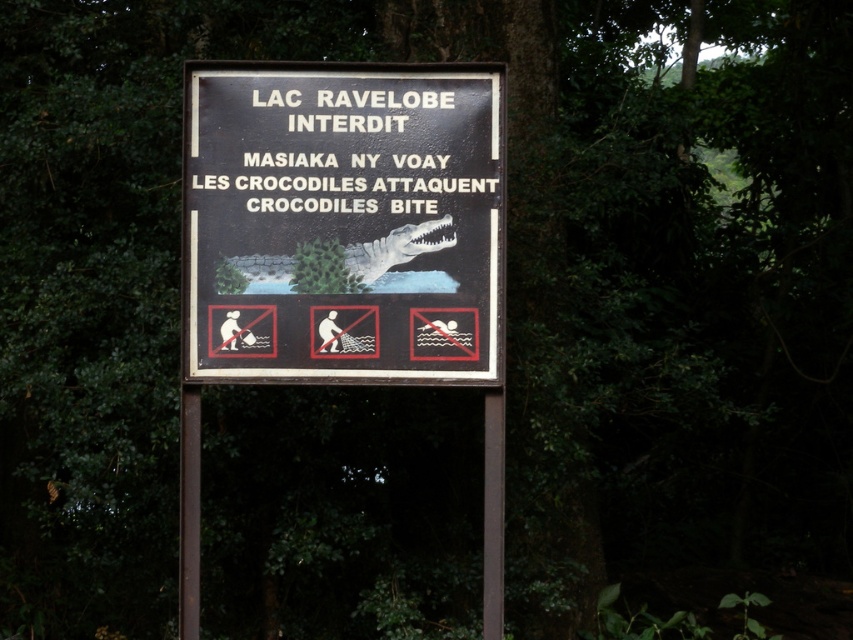
Does black plastic sign at center have a larger size compared to metallic pole at center?

Correct, black plastic sign at center is larger in size than metallic pole at center.

Measure the distance between black plastic sign at center and camera.

A distance of 6.71 meters exists between black plastic sign at center and camera.

In order to click on black plastic sign at center in this screenshot , I will do `click(343, 221)`.